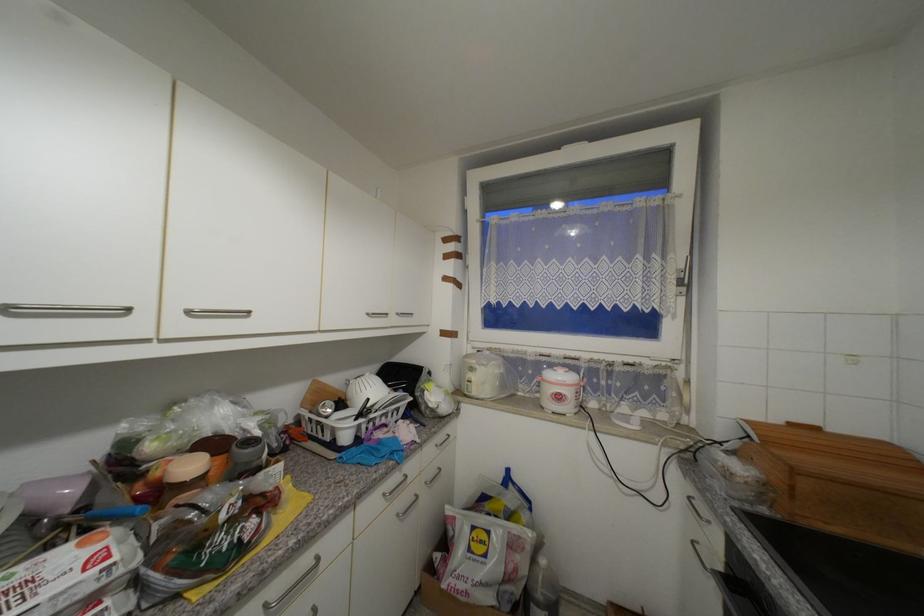
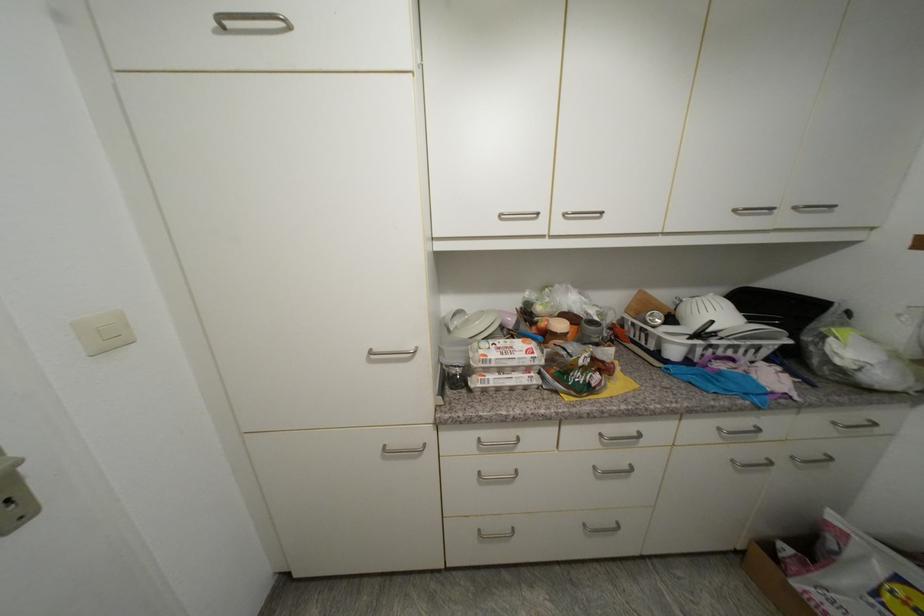
Where in the second image is the point corresponding to point 403,315 from the first image?

(800, 209)